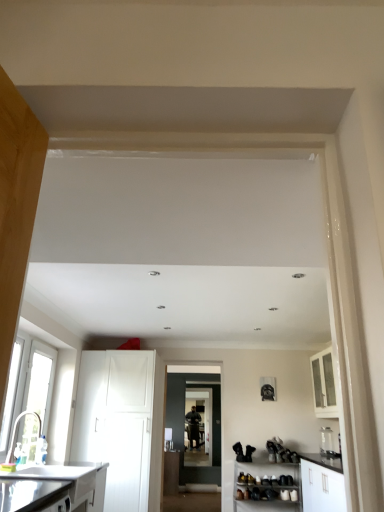
Question: From a real-world perspective, is white matte shoe rack at lower right, the 4th cabinetry positioned from the front, below white glossy countertop at lower left?

Choices:
 (A) yes
 (B) no

Answer: (A)

Question: Could white glossy countertop at lower left be considered to be inside white matte shoe rack at lower right, positioned as the 4th cabinetry in left-to-right order?

Choices:
 (A) no
 (B) yes

Answer: (A)

Question: Is the depth of white matte shoe rack at lower right, the 4th cabinetry positioned from the front, greater than that of white glossy countertop at lower left?

Choices:
 (A) no
 (B) yes

Answer: (B)

Question: Considering the relative positions of white matte shoe rack at lower right, marked as the second cabinetry in a right-to-left arrangement, and white glossy countertop at lower left in the image provided, is white matte shoe rack at lower right, marked as the second cabinetry in a right-to-left arrangement, to the right of white glossy countertop at lower left from the viewer's perspective?

Choices:
 (A) no
 (B) yes

Answer: (B)

Question: From the image's perspective, is white matte shoe rack at lower right, marked as the second cabinetry in a right-to-left arrangement, beneath white glossy countertop at lower left?

Choices:
 (A) no
 (B) yes

Answer: (B)

Question: Is white matte shoe rack at lower right, marked as the second cabinetry in a right-to-left arrangement, positioned before white glossy countertop at lower left?

Choices:
 (A) yes
 (B) no

Answer: (B)

Question: Is brushed metal sink at lower left bigger than white matte shoe rack at lower right, positioned as the 4th cabinetry in left-to-right order?

Choices:
 (A) no
 (B) yes

Answer: (A)

Question: Can you confirm if brushed metal sink at lower left is shorter than white matte shoe rack at lower right, positioned as the 4th cabinetry in left-to-right order?

Choices:
 (A) yes
 (B) no

Answer: (A)

Question: Does brushed metal sink at lower left have a smaller size compared to white matte shoe rack at lower right, the 4th cabinetry positioned from the front?

Choices:
 (A) yes
 (B) no

Answer: (A)

Question: From a real-world perspective, does brushed metal sink at lower left stand above white matte shoe rack at lower right, which is counted as the 2th cabinetry, starting from the back?

Choices:
 (A) yes
 (B) no

Answer: (A)

Question: From the image's perspective, is brushed metal sink at lower left above white matte shoe rack at lower right, marked as the second cabinetry in a right-to-left arrangement?

Choices:
 (A) no
 (B) yes

Answer: (B)

Question: Is brushed metal sink at lower left far away from white matte shoe rack at lower right, the 4th cabinetry positioned from the front?

Choices:
 (A) no
 (B) yes

Answer: (B)

Question: Could matte black door at center be considered to be inside white plastic window at left, placed as the 2th window when sorted from front to back?

Choices:
 (A) yes
 (B) no

Answer: (B)